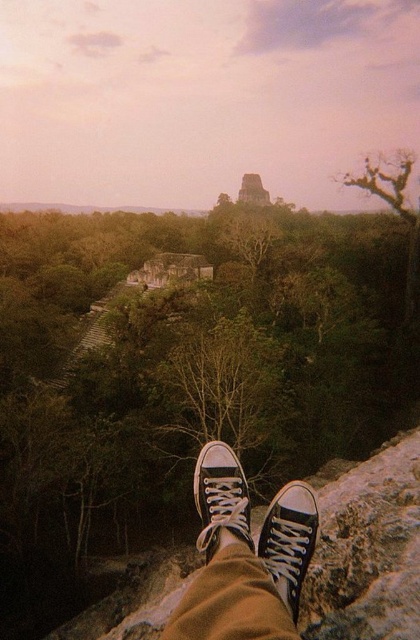
You are standing at the point with coordinates point (223, 481) and want to walk towards the point with coordinates point (281, 545). Which direction should you move relative to your current position?

You should move forward because point (281, 545) is in front of point (223, 481).

You are a photographer setting up a tripod to capture the forest landscape. You notice two objects at the lower center of the image. Which one is narrower between the black canvas sneakers at lower center and the black canvas shoe at lower center?

The black canvas sneakers at lower center is narrower than the black canvas shoe at lower center.

Consider the image. You are a hiker who has just found a pair of shoes in the forest. You see the black canvas sneakers at lower center and the black canvas shoe at center. Which one is closer to you?

The black canvas sneakers at lower center is closer to you because it is 8.16 feet away from the black canvas shoe at center, meaning the sneakers are nearer than the shoe.